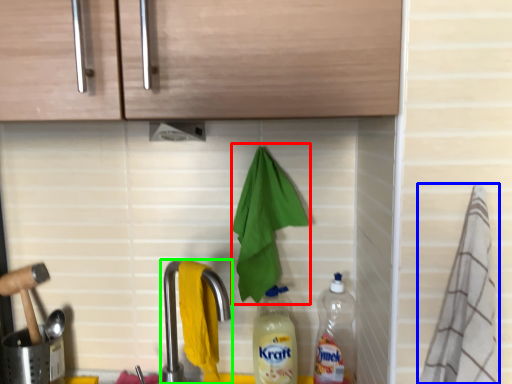
Question: Which object is positioned closest to hand towel (highlighted by a red box)? Select from material (highlighted by a blue box) and tap (highlighted by a green box).

Choices:
 (A) material
 (B) tap

Answer: (B)